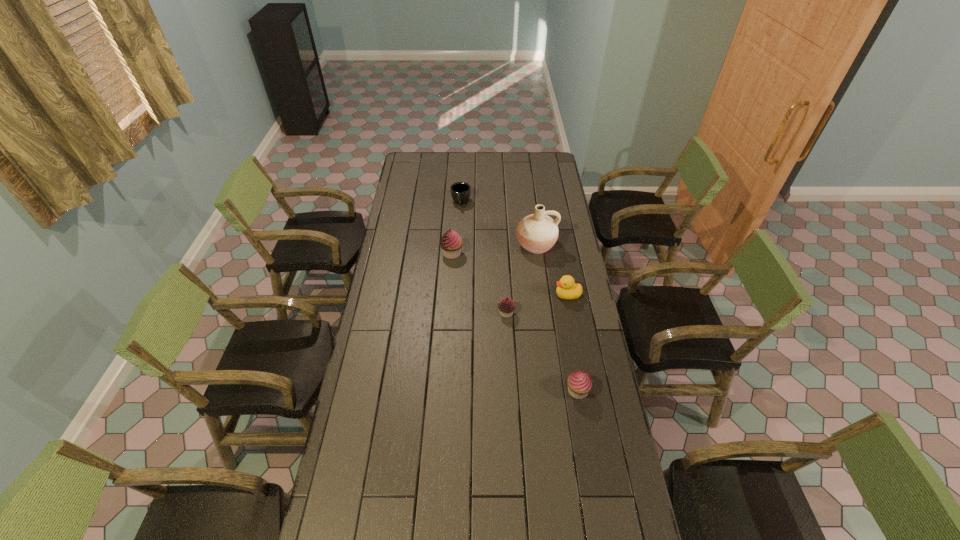
Select which cupcake is the closest to the tallest cupcake. Please provide its 2D coordinates. Your answer should be formatted as a tuple, i.e. [(x, y)], where the tuple contains the x and y coordinates of a point satisfying the conditions above.

[(506, 306)]

What are the coordinates of `vacant space that satisfies the following two spatial constraints: 1. on the side of the mug with the handle; 2. on the left side of the third object from left to right` in the screenshot? It's located at (455, 313).

The image size is (960, 540). I want to click on free space that satisfies the following two spatial constraints: 1. on the side of the second tallest cupcake with the handle; 2. on the right side of the farthest object, so click(451, 391).

This screenshot has width=960, height=540. Identify the location of free space in the image that satisfies the following two spatial constraints: 1. on the side of the mug with the handle; 2. on the right side of the second cupcake from left to right. (455, 313).

At what (x,y) coordinates should I click in order to perform the action: click on free space that satisfies the following two spatial constraints: 1. on the side of the second farthest cupcake with the handle; 2. on the left side of the mug. Please return your answer as a coordinate pair (x, y). The width and height of the screenshot is (960, 540). Looking at the image, I should click on (455, 313).